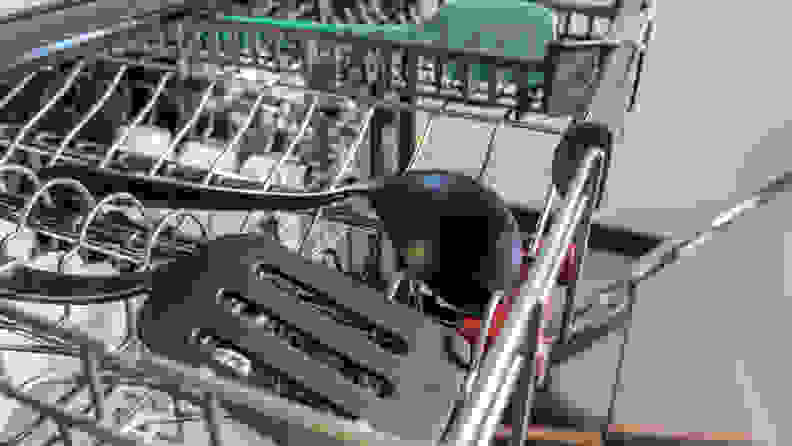
Find the location of a particular element. slotted spatula is located at coordinates (406, 380).